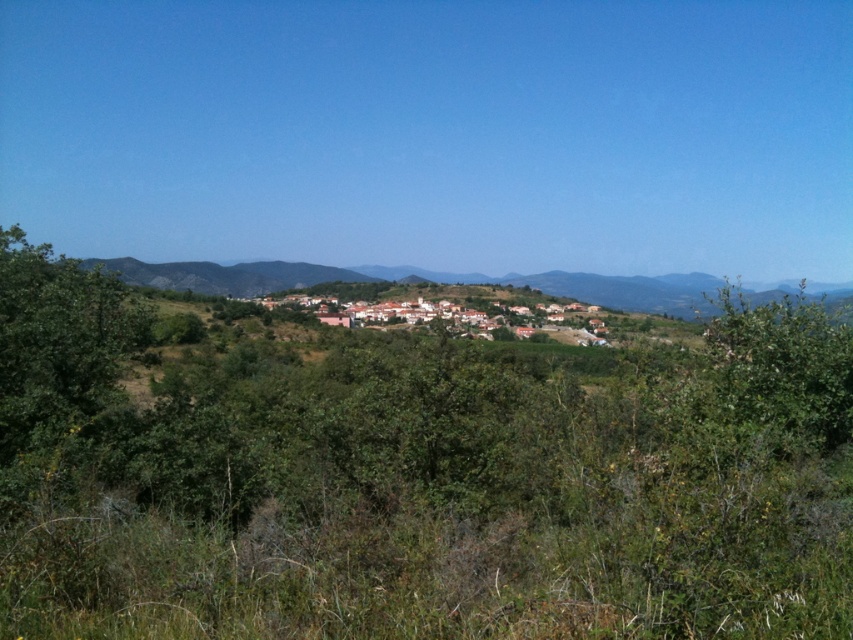
Describe the element at coordinates (57, 342) in the screenshot. I see `green leafy tree at left` at that location.

How far apart are green leafy tree at left and green leafy bush at upper right?

green leafy tree at left is 12.51 meters away from green leafy bush at upper right.

The image size is (853, 640). I want to click on green leafy tree at left, so click(x=57, y=342).

At what (x,y) coordinates should I click in order to perform the action: click on green leafy tree at left. Please return your answer as a coordinate pair (x, y). The image size is (853, 640). Looking at the image, I should click on (57, 342).